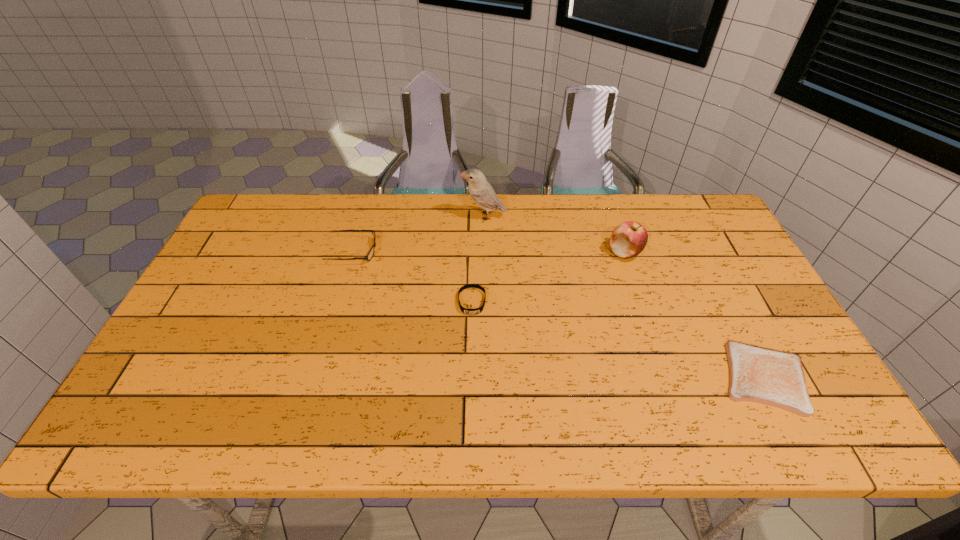
Image resolution: width=960 pixels, height=540 pixels. Find the location of `free space that satisfies the following two spatial constraints: 1. on the front-facing side of the shortest object; 2. on the left side of the sunglasses`. free space that satisfies the following two spatial constraints: 1. on the front-facing side of the shortest object; 2. on the left side of the sunglasses is located at coordinates (316, 377).

Locate an element on the screen. The height and width of the screenshot is (540, 960). vacant area in the image that satisfies the following two spatial constraints: 1. on the front-facing side of the leftmost object; 2. on the right side of the fourth shortest object is located at coordinates (353, 252).

You are a GUI agent. You are given a task and a screenshot of the screen. Output one action in this format:
    pyautogui.click(x=<x>, y=<y>)
    Task: Click on the free location that satisfies the following two spatial constraints: 1. on the front-facing side of the second tallest object; 2. on the right side of the third tallest object
    
    Given the screenshot: What is the action you would take?
    pyautogui.click(x=353, y=252)

Where is `free point that satisfies the following two spatial constraints: 1. on the front-facing side of the shortest object; 2. on the left side of the sunglasses`? The width and height of the screenshot is (960, 540). free point that satisfies the following two spatial constraints: 1. on the front-facing side of the shortest object; 2. on the left side of the sunglasses is located at coordinates (316, 377).

The image size is (960, 540). In order to click on vacant space that satisfies the following two spatial constraints: 1. on the display of the fourth farthest object; 2. on the right side of the nearest object in this screenshot , I will do `click(470, 377)`.

At what (x,y) coordinates should I click in order to perform the action: click on free space that satisfies the following two spatial constraints: 1. on the front-facing side of the sunglasses; 2. on the left side of the apple. Please return your answer as a coordinate pair (x, y). This screenshot has width=960, height=540. Looking at the image, I should click on (353, 252).

Image resolution: width=960 pixels, height=540 pixels. I want to click on vacant space that satisfies the following two spatial constraints: 1. on the front-facing side of the fourth object from left to right; 2. on the right side of the leftmost object, so click(x=353, y=252).

Find the location of `vacant space that satisfies the following two spatial constraints: 1. on the front-facing side of the nearest object; 2. on the left side of the sunglasses`. vacant space that satisfies the following two spatial constraints: 1. on the front-facing side of the nearest object; 2. on the left side of the sunglasses is located at coordinates (316, 377).

Locate an element on the screen. Image resolution: width=960 pixels, height=540 pixels. free location that satisfies the following two spatial constraints: 1. at the face of the bird; 2. on the display of the fourth tallest object is located at coordinates (484, 302).